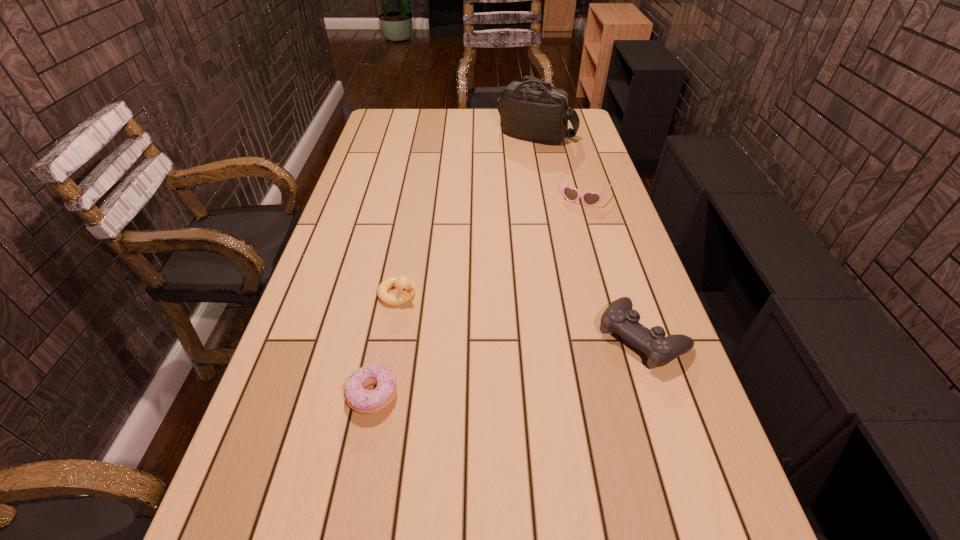
Locate an element on the screen. The height and width of the screenshot is (540, 960). vacant point located between the duckling and the control is located at coordinates (520, 315).

The width and height of the screenshot is (960, 540). I want to click on free space between the farthest object and the control, so click(589, 236).

You are a GUI agent. You are given a task and a screenshot of the screen. Output one action in this format:
    pyautogui.click(x=<x>, y=<y>)
    Task: Click on the empty location between the duckling and the doughnut
    This screenshot has height=540, width=960.
    Given the screenshot: What is the action you would take?
    pyautogui.click(x=385, y=345)

Identify the location of vacant point located between the sunglasses and the doughnut. (479, 296).

Locate an element on the screen. free space between the doughnut and the duckling is located at coordinates point(385,345).

Where is `vacant point located between the control and the doughnut`? The image size is (960, 540). vacant point located between the control and the doughnut is located at coordinates (508, 366).

You are a GUI agent. You are given a task and a screenshot of the screen. Output one action in this format:
    pyautogui.click(x=<x>, y=<y>)
    Task: Click on the free spot between the control and the tallest object
    
    Given the screenshot: What is the action you would take?
    pyautogui.click(x=589, y=236)

Locate an element on the screen. This screenshot has height=540, width=960. empty space that is in between the control and the sunglasses is located at coordinates (613, 266).

Select which object appears as the third closest to the sunglasses. Please provide its 2D coordinates. Your answer should be formatted as a tuple, i.e. [(x, y)], where the tuple contains the x and y coordinates of a point satisfying the conditions above.

[(406, 289)]

Where is `the closest object to the farthest object`? the closest object to the farthest object is located at coordinates (589, 198).